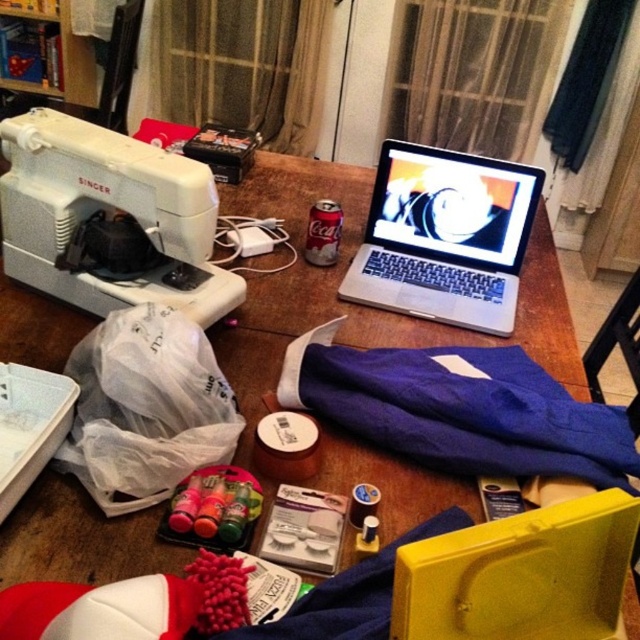
You are trying to locate the purple fabric at center on the table. According to the coordinates provided, where exactly is it positioned?

The purple fabric at center is located at the coordinates point (460, 410).

You are organizing the items on the table and need to place the purple fabric at center. Where should you place it in relation to the white plastic sewing machine at left?

The purple fabric at center is below the white plastic sewing machine at left, so you should place it underneath the sewing machine.